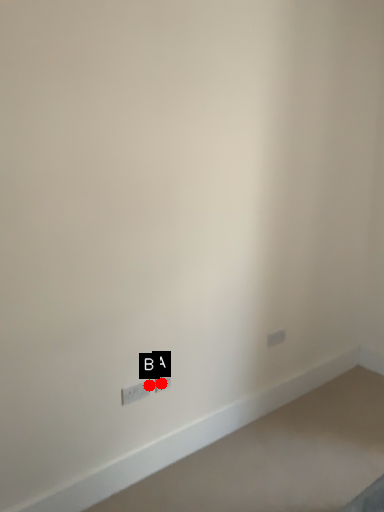
Question: Two points are circled on the image, labeled by A and B beside each circle. Which point appears closest to the camera in this image?

Choices:
 (A) A is closer
 (B) B is closer

Answer: (B)